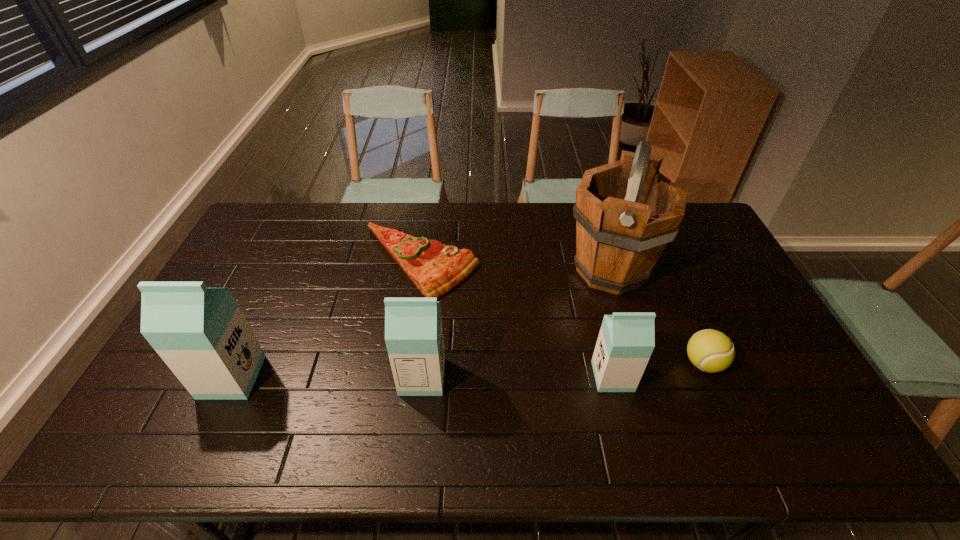
Identify the location of vacant space that is in between the bucket and the fifth tallest object. This screenshot has height=540, width=960. (657, 317).

I want to click on the fourth closest object to the tallest object, so click(413, 326).

Where is `object that stands as the fifth closest to the shortest milk carton`? The width and height of the screenshot is (960, 540). object that stands as the fifth closest to the shortest milk carton is located at coordinates (201, 334).

Identify which milk carton is located as the second nearest to the leftmost object. Please provide its 2D coordinates. Your answer should be formatted as a tuple, i.e. [(x, y)], where the tuple contains the x and y coordinates of a point satisfying the conditions above.

[(626, 340)]

Select which milk carton appears as the closest to the bucket. Please provide its 2D coordinates. Your answer should be formatted as a tuple, i.e. [(x, y)], where the tuple contains the x and y coordinates of a point satisfying the conditions above.

[(626, 340)]

Locate an element on the screen. Image resolution: width=960 pixels, height=540 pixels. free location that satisfies the following two spatial constraints: 1. on the back side of the leftmost object; 2. on the right side of the third tallest object is located at coordinates (232, 376).

Image resolution: width=960 pixels, height=540 pixels. I want to click on free space that satisfies the following two spatial constraints: 1. on the front side of the second milk carton from left to right; 2. on the right side of the pizza, so click(402, 376).

You are a GUI agent. You are given a task and a screenshot of the screen. Output one action in this format:
    pyautogui.click(x=<x>, y=<y>)
    Task: Click on the free location that satisfies the following two spatial constraints: 1. on the front side of the second shortest object; 2. on the left side of the bucket
    This screenshot has width=960, height=540.
    Given the screenshot: What is the action you would take?
    pyautogui.click(x=639, y=363)

At what (x,y) coordinates should I click in order to perform the action: click on vacant space that satisfies the following two spatial constraints: 1. on the back side of the leftmost object; 2. on the right side of the fourth tallest object. Please return your answer as a coordinate pair (x, y). Image resolution: width=960 pixels, height=540 pixels. Looking at the image, I should click on (232, 376).